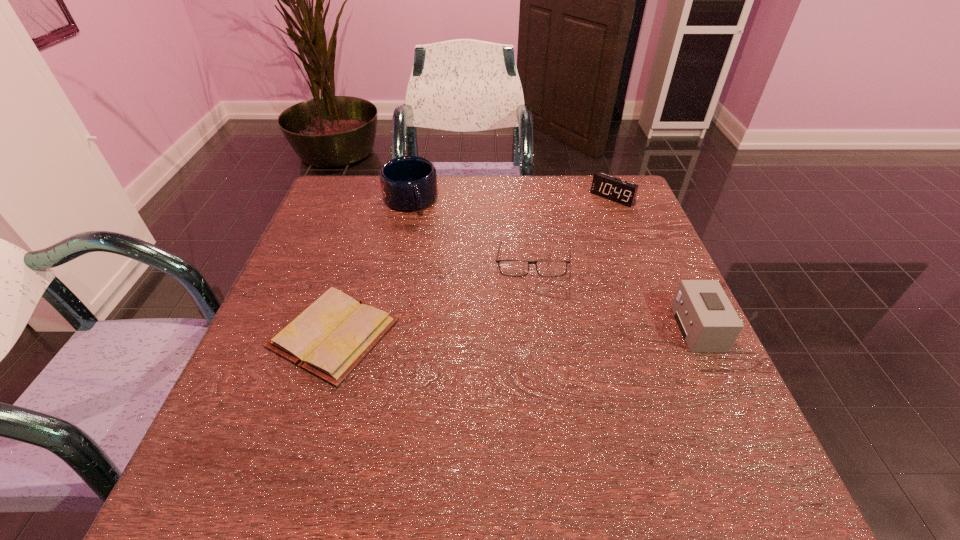
The height and width of the screenshot is (540, 960). What are the coordinates of `vacant space at the far edge of the desktop` in the screenshot? It's located at (501, 185).

Where is `vacant area at the near edge`? The height and width of the screenshot is (540, 960). vacant area at the near edge is located at coordinates (447, 431).

The height and width of the screenshot is (540, 960). In order to click on vacant space at the left edge of the desktop in this screenshot , I will do `click(359, 268)`.

Image resolution: width=960 pixels, height=540 pixels. I want to click on free space at the right edge, so click(x=619, y=308).

Identify the location of vacant space at the far left corner of the desktop. Image resolution: width=960 pixels, height=540 pixels. (338, 207).

Find the location of a particular element. The height and width of the screenshot is (540, 960). vacant area at the near left corner of the desktop is located at coordinates (291, 431).

In order to click on free region at the far right corner of the desktop in this screenshot , I will do `click(591, 207)`.

At what (x,y) coordinates should I click in order to perform the action: click on free space at the near right corner of the desktop. Please return your answer as a coordinate pair (x, y). This screenshot has height=540, width=960. Looking at the image, I should click on (705, 421).

The image size is (960, 540). Find the location of `free space between the shortest object and the third object from left to right`. free space between the shortest object and the third object from left to right is located at coordinates (433, 299).

The width and height of the screenshot is (960, 540). Identify the location of free point between the spectacles and the shortest object. (433, 299).